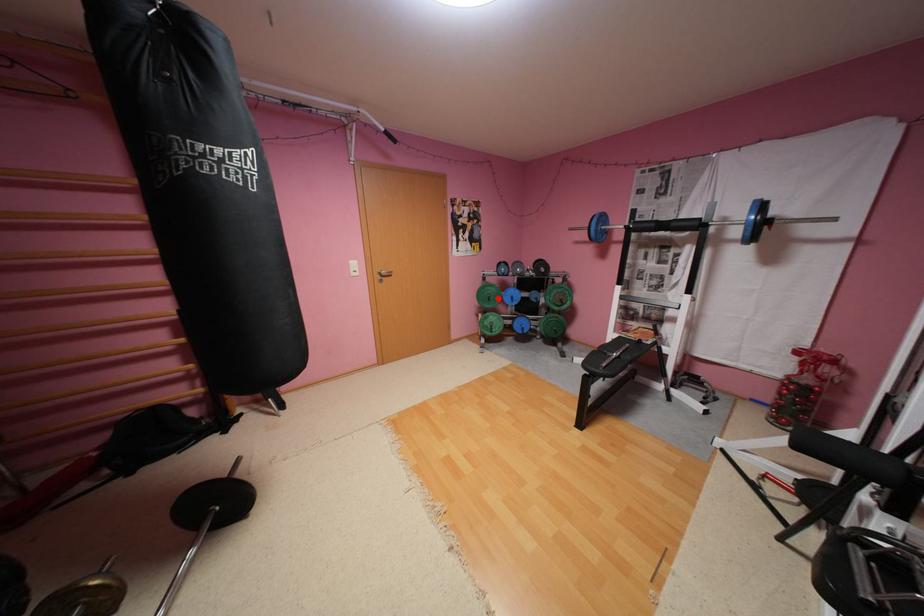
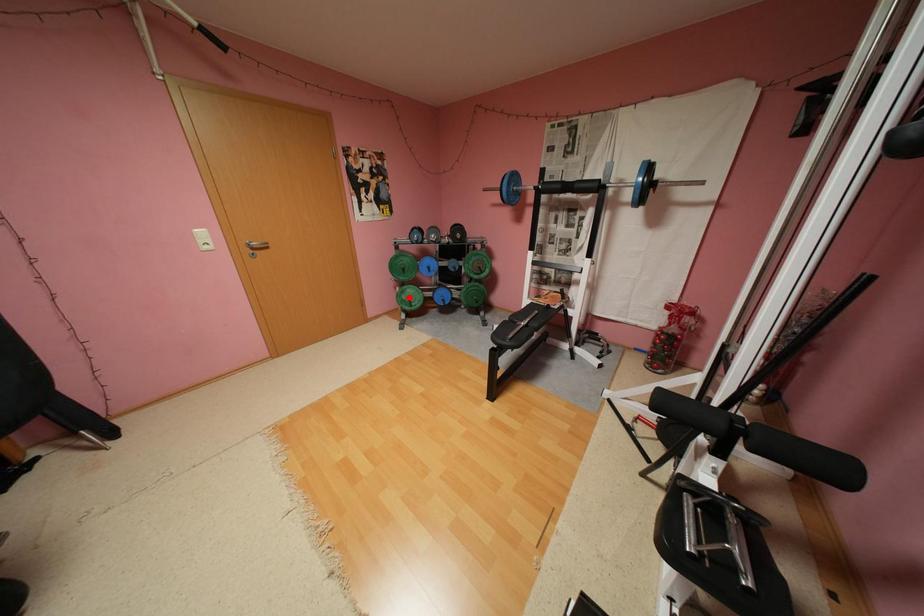
I am providing you with two images of the same scene from different viewpoints. A red point is marked on the first image and another point is marked on the second image. Are the points marked in image1 and image2 representing the same 3D position?

No